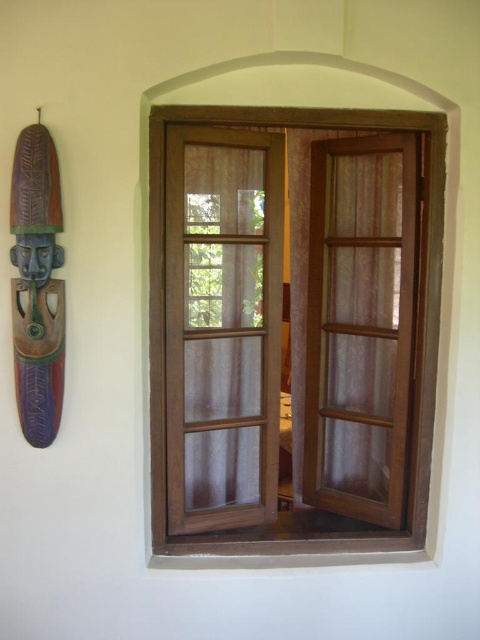
Is translucent sheer curtain at center taller than brown wood window at center?

In fact, translucent sheer curtain at center may be shorter than brown wood window at center.

Consider the image. Is translucent sheer curtain at center above brown wood window at center?

Correct, translucent sheer curtain at center is located above brown wood window at center.

Describe the element at coordinates (223, 323) in the screenshot. I see `translucent sheer curtain at center` at that location.

The image size is (480, 640). I want to click on translucent sheer curtain at center, so click(x=223, y=323).

Who is higher up, translucent sheer curtain at center or sheer fabric curtain at right?

sheer fabric curtain at right

Does point (232, 200) come closer to viewer compared to point (383, 394)?

That is True.

The height and width of the screenshot is (640, 480). What do you see at coordinates (223, 323) in the screenshot? I see `translucent sheer curtain at center` at bounding box center [223, 323].

The image size is (480, 640). Find the location of `translucent sheer curtain at center`. translucent sheer curtain at center is located at coordinates (223, 323).

What are the coordinates of `sheer fabric curtain at right` in the screenshot? It's located at (360, 321).

Identify the location of sheer fabric curtain at right. This screenshot has width=480, height=640. (360, 321).